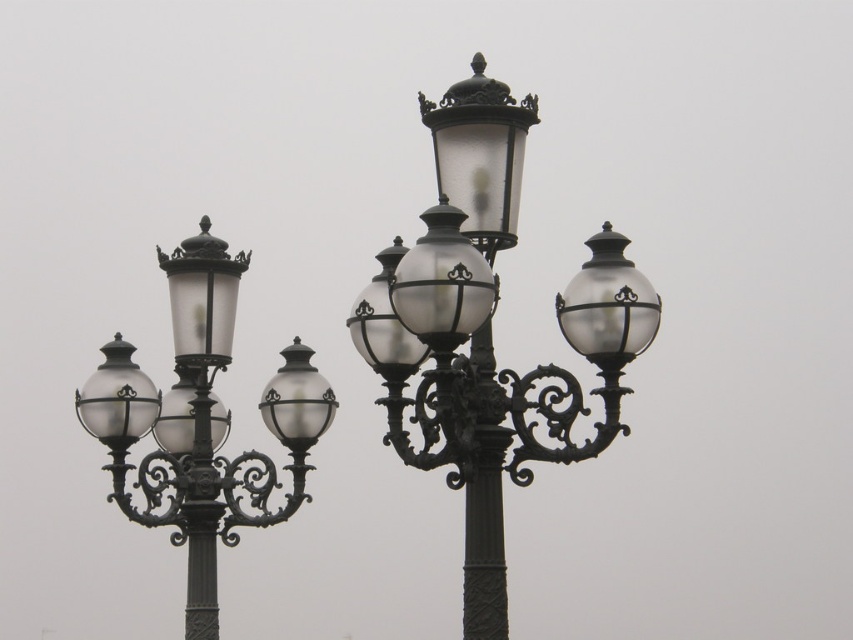
Question: Is matte black street light at center above satin silver globe at center?

Choices:
 (A) yes
 (B) no

Answer: (A)

Question: Is matte black street light at center wider than satin silver globe at center?

Choices:
 (A) yes
 (B) no

Answer: (A)

Question: Which point is closer to the camera taking this photo?

Choices:
 (A) (320, 422)
 (B) (254, 486)
 (C) (457, 403)

Answer: (C)

Question: Which point is closer to the camera?

Choices:
 (A) matte black street light at center
 (B) satin silver globe at center

Answer: (A)

Question: Can you confirm if matte black street light at center is positioned above satin silver globe at center?

Choices:
 (A) no
 (B) yes

Answer: (B)

Question: Among these objects, which one is nearest to the camera?

Choices:
 (A) matte black street light at center
 (B) matte black street light at left

Answer: (A)